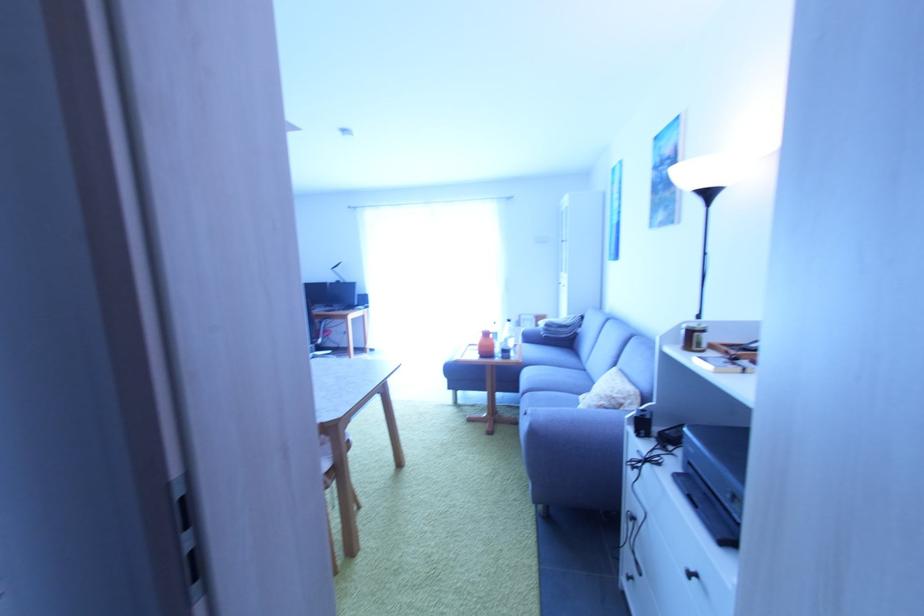
Describe the element at coordinates (574, 456) in the screenshot. The image size is (924, 616). I see `a sofa armrest` at that location.